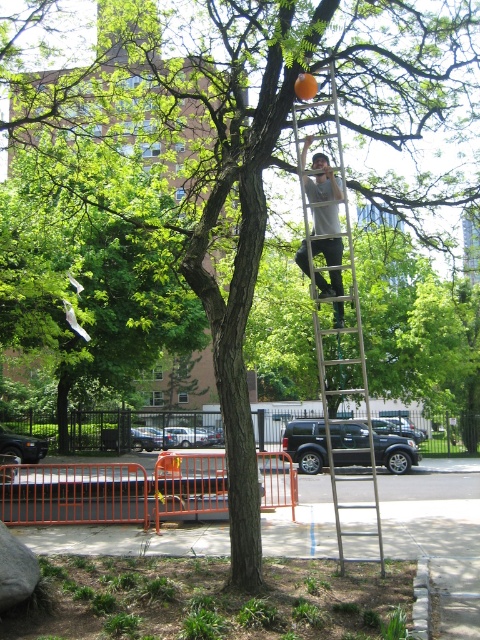
Who is shorter, silver metallic ladder at center or gray cotton shirt at upper center?

gray cotton shirt at upper center

Does silver metallic ladder at center appear on the right side of gray cotton shirt at upper center?

Indeed, silver metallic ladder at center is positioned on the right side of gray cotton shirt at upper center.

Which is behind, point (340, 548) or point (334, 252)?

Point (334, 252)

The height and width of the screenshot is (640, 480). Find the location of `silver metallic ladder at center`. silver metallic ladder at center is located at coordinates (x=335, y=298).